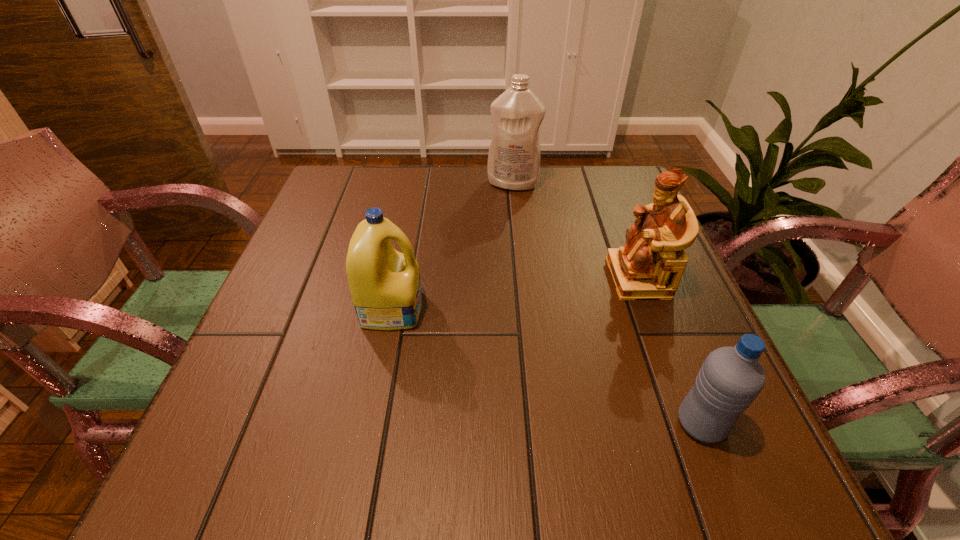
The width and height of the screenshot is (960, 540). Identify the location of empty space between the farther detergent and the nearer detergent. (452, 246).

Identify the location of unoccupied area between the figurine and the nearest object. (670, 350).

This screenshot has height=540, width=960. I want to click on free space between the nearer detergent and the figurine, so click(x=516, y=293).

Where is `free space between the nearest object and the shorter detergent`? Image resolution: width=960 pixels, height=540 pixels. free space between the nearest object and the shorter detergent is located at coordinates (546, 366).

Identify which object is the second closest to the shorter detergent. Please provide its 2D coordinates. Your answer should be formatted as a tuple, i.e. [(x, y)], where the tuple contains the x and y coordinates of a point satisfying the conditions above.

[(650, 266)]

Select which object is the second closest to the water bottle. Please provide its 2D coordinates. Your answer should be formatted as a tuple, i.e. [(x, y)], where the tuple contains the x and y coordinates of a point satisfying the conditions above.

[(385, 286)]

Identify the location of free region that satisfies the following two spatial constraints: 1. on the label of the nearest object; 2. on the right side of the nearer detergent. (370, 424).

At what (x,y) coordinates should I click in order to perform the action: click on free space that satisfies the following two spatial constraints: 1. on the label of the water bottle; 2. on the left side of the left detergent. Please return your answer as a coordinate pair (x, y). Looking at the image, I should click on (370, 424).

The width and height of the screenshot is (960, 540). What are the coordinates of `vacant space that satisfies the following two spatial constraints: 1. on the label of the shorter detergent; 2. on the right side of the nearest object` in the screenshot? It's located at (370, 424).

Locate an element on the screen. vacant region that satisfies the following two spatial constraints: 1. on the back side of the water bottle; 2. on the front-facing side of the figurine is located at coordinates (643, 278).